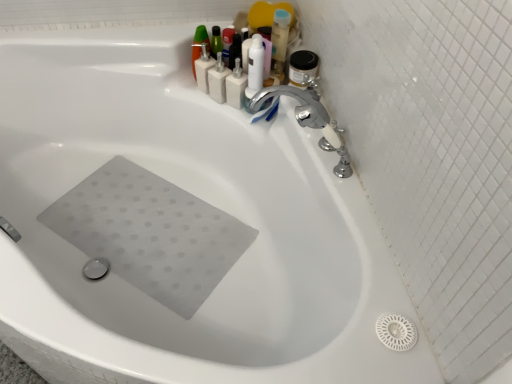
Question: Does chrome metallic faucet at upper right, the 2th tap from the back, come in front of matte black pump bottle at upper center, marked as the third toiletry in a left-to-right arrangement?

Choices:
 (A) yes
 (B) no

Answer: (A)

Question: Can you confirm if chrome metallic faucet at upper right, the 2th tap from the back, is taller than matte black pump bottle at upper center, marked as the third toiletry in a left-to-right arrangement?

Choices:
 (A) no
 (B) yes

Answer: (B)

Question: From a real-world perspective, is chrome metallic faucet at upper right, the 2th tap from the back, under matte black pump bottle at upper center, arranged as the 2th toiletry when viewed from the right?

Choices:
 (A) no
 (B) yes

Answer: (A)

Question: Is the depth of chrome metallic faucet at upper right, which is counted as the 1th tap, starting from the front, greater than that of matte black pump bottle at upper center, arranged as the 2th toiletry when viewed from the right?

Choices:
 (A) no
 (B) yes

Answer: (A)

Question: Is matte black pump bottle at upper center, arranged as the 2th toiletry when viewed from the right, surrounded by chrome metallic faucet at upper right, the 2th tap from the back?

Choices:
 (A) no
 (B) yes

Answer: (A)

Question: Is chrome metallic faucet at upper right, which is counted as the 1th tap, starting from the front, facing towards matte black pump bottle at upper center, marked as the third toiletry in a left-to-right arrangement?

Choices:
 (A) yes
 (B) no

Answer: (B)

Question: From the image's perspective, is white plastic pump at upper center, the fourth toiletry in the left-to-right sequence, under chrome metallic faucet at upper right, which is counted as the 1th tap, starting from the front?

Choices:
 (A) yes
 (B) no

Answer: (B)

Question: Is white plastic pump at upper center, the fourth toiletry in the left-to-right sequence, far away from chrome metallic faucet at upper right, the 2th tap from the back?

Choices:
 (A) no
 (B) yes

Answer: (A)

Question: Is white plastic pump at upper center, the fourth toiletry in the left-to-right sequence, aimed at chrome metallic faucet at upper right, the 2th tap from the back?

Choices:
 (A) no
 (B) yes

Answer: (A)

Question: Is chrome metallic faucet at upper right, which is counted as the 1th tap, starting from the front, at the back of white plastic pump at upper center, the fourth toiletry in the left-to-right sequence?

Choices:
 (A) no
 (B) yes

Answer: (A)

Question: Is white plastic pump at upper center, which is counted as the 1th toiletry, starting from the right, thinner than chrome metallic faucet at upper right, the 2th tap from the back?

Choices:
 (A) no
 (B) yes

Answer: (B)

Question: Does white plastic pump at upper center, which is counted as the 1th toiletry, starting from the right, appear on the left side of chrome metallic faucet at upper right, the 2th tap from the back?

Choices:
 (A) no
 (B) yes

Answer: (B)

Question: Is white plastic soap dispenser at upper center, which ranks as the fourth toiletry in right-to-left order, bigger than matte black pump bottle at upper center, arranged as the 2th toiletry when viewed from the right?

Choices:
 (A) no
 (B) yes

Answer: (B)